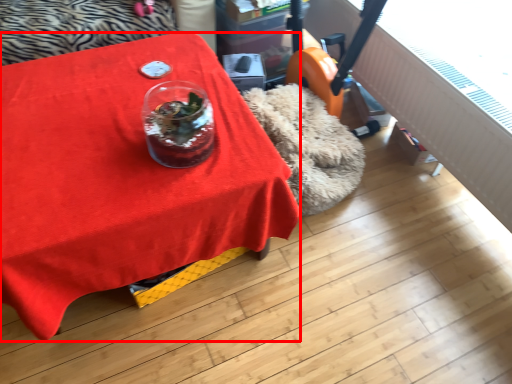
Question: From the image, what is the correct spatial relationship of table (annotated by the red box) in relation to glass vase?

Choices:
 (A) left
 (B) right

Answer: (A)